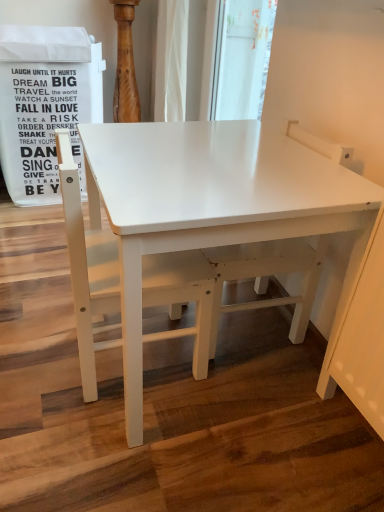
Question: Based on their sizes in the image, would you say white matte chair at left is bigger or smaller than white matte swivel chair at center?

Choices:
 (A) small
 (B) big

Answer: (A)

Question: Considering the positions of white matte chair at left and white matte swivel chair at center in the image, is white matte chair at left taller or shorter than white matte swivel chair at center?

Choices:
 (A) short
 (B) tall

Answer: (A)

Question: Estimate the real-world distances between objects in this image. Which object is farther from the white matte chair at left?

Choices:
 (A) white matte table at center
 (B) white matte swivel chair at center

Answer: (B)

Question: Estimate the real-world distances between objects in this image. Which object is closer to the white matte swivel chair at center?

Choices:
 (A) white matte table at center
 (B) white matte chair at left

Answer: (A)